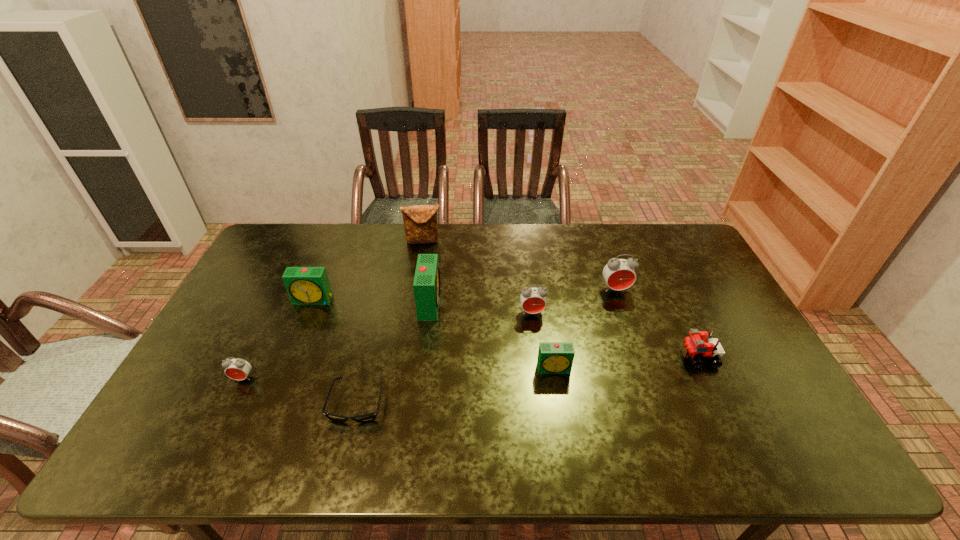
Where is `free area in between the second red alarm clock from right to left and the sunglasses`? Image resolution: width=960 pixels, height=540 pixels. free area in between the second red alarm clock from right to left and the sunglasses is located at coordinates (444, 358).

This screenshot has height=540, width=960. What are the coordinates of `vacant area between the second alarm clock from left to right and the red Lego` in the screenshot? It's located at (506, 329).

The height and width of the screenshot is (540, 960). I want to click on blank region between the clutch bag and the second alarm clock from left to right, so click(369, 271).

The height and width of the screenshot is (540, 960). In order to click on unoccupied position between the second object from right to left and the second red alarm clock from right to left in this screenshot , I will do `click(574, 301)`.

I want to click on vacant area between the farthest object and the second smallest red alarm clock, so click(478, 277).

Point out which object is positioned as the fifth nearest to the second smallest red alarm clock. Please provide its 2D coordinates. Your answer should be formatted as a tuple, i.e. [(x, y)], where the tuple contains the x and y coordinates of a point satisfying the conditions above.

[(420, 222)]

The height and width of the screenshot is (540, 960). In order to click on object that is the eighth nearest to the shortest object in this screenshot , I will do `click(693, 347)`.

You are a GUI agent. You are given a task and a screenshot of the screen. Output one action in this format:
    pyautogui.click(x=<x>, y=<y>)
    Task: Click on the alarm clock that stands as the fifth closest to the farthest object
    Image resolution: width=960 pixels, height=540 pixels.
    Given the screenshot: What is the action you would take?
    pyautogui.click(x=553, y=357)

Where is `alarm clock that is the closest to the farthest object`? This screenshot has width=960, height=540. alarm clock that is the closest to the farthest object is located at coordinates [426, 285].

Locate an element on the screen. This screenshot has width=960, height=540. the closest red alarm clock to the biggest red alarm clock is located at coordinates (533, 300).